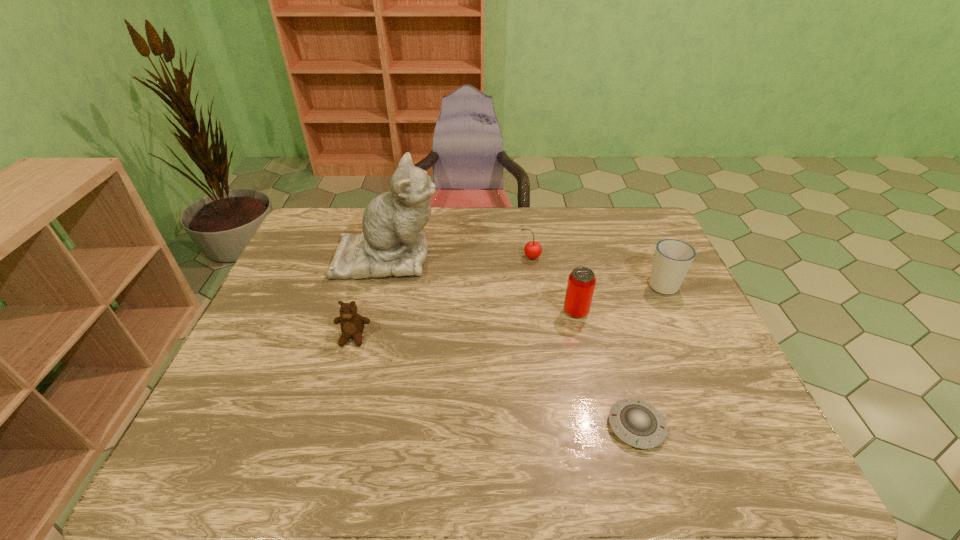
This screenshot has height=540, width=960. I want to click on free spot that satisfies the following two spatial constraints: 1. at the face of the teddy bear; 2. on the right side of the nearest object, so click(x=328, y=426).

The height and width of the screenshot is (540, 960). Identify the location of free space in the image that satisfies the following two spatial constraints: 1. at the face of the saucer; 2. on the left side of the second nearest object. (328, 426).

The width and height of the screenshot is (960, 540). In order to click on vacant region that satisfies the following two spatial constraints: 1. on the front side of the shortest object; 2. on the right side of the cherry in this screenshot , I will do `click(553, 426)`.

This screenshot has height=540, width=960. I want to click on free spot that satisfies the following two spatial constraints: 1. on the front-facing side of the third object from left to right; 2. on the right side of the cat, so click(x=387, y=258).

The image size is (960, 540). I want to click on blank area in the image that satisfies the following two spatial constraints: 1. at the face of the saucer; 2. on the left side of the teddy bear, so click(328, 426).

This screenshot has height=540, width=960. I want to click on vacant space that satisfies the following two spatial constraints: 1. on the front side of the cherry; 2. on the left side of the fourth farthest object, so click(x=538, y=312).

At what (x,y) coordinates should I click in order to perform the action: click on free space that satisfies the following two spatial constraints: 1. on the front-facing side of the cat; 2. on the back side of the third nearest object. Please return your answer as a coordinate pair (x, y). The width and height of the screenshot is (960, 540). Looking at the image, I should click on (373, 312).